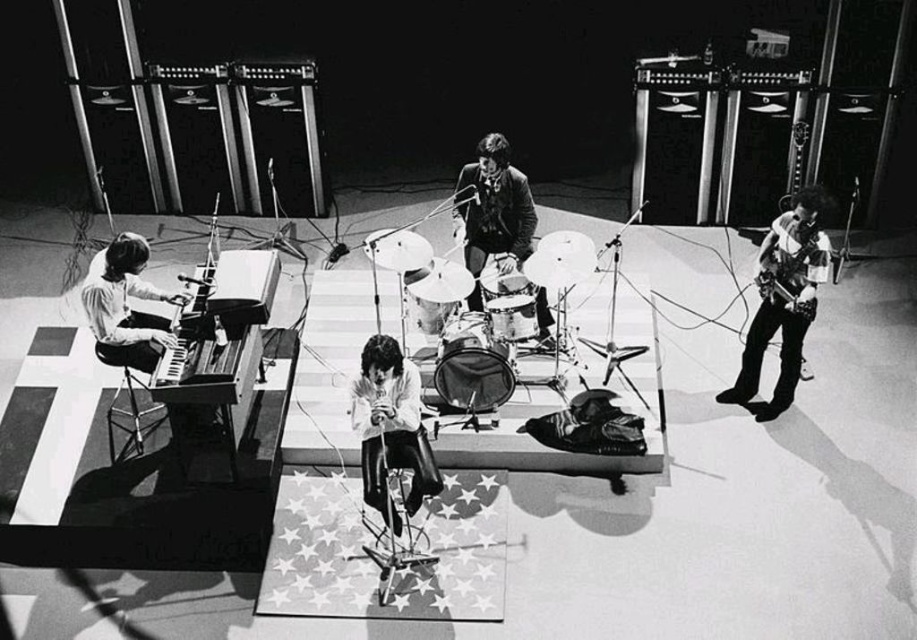
You are a photographer positioned at the back of the venue. You want to take a photo of the leather jacket at center and the smooth black piano at left. Based on their positions, which object should you focus on first if you start from the left side of the stage and move towards the right?

The smooth black piano at left is on the left side, so you should focus on it first before moving to the leather jacket at center.

Based on the photo, you are a photographer positioned at the back of the venue. You need to capture a photo that includes both the white leather jacket at center and the smooth black piano at left. Based on their positions, which object should you adjust your camera focus to first to ensure both are in frame?

The white leather jacket at center is to the right of the smooth black piano at left. Since the photographer is at the back, adjusting focus on the smooth black piano at left first would help frame both objects as the piano is on the left side and the jacket is positioned further right.

In the scene shown: You are a photographer standing behind the stage. You need to capture a photo that includes both the leather jacket at center and the smooth black piano at left. What is the minimum distance you should move forward to ensure both objects are in frame?

The leather jacket at center and the smooth black piano at left are 2.26 meters apart from each other. To capture both in the frame, the photographer must ensure the camera can accommodate this distance within its field of view. The exact distance to move forward depends on the camera lens and sensor size, but knowing the objects are 2.26 meters apart helps in adjusting the shot accordingly.